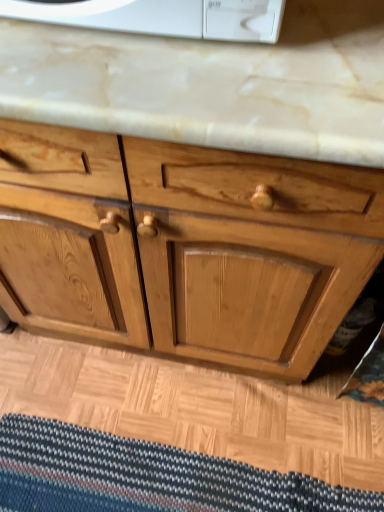
Question: Is striped fabric doormat at lower center spatially inside light brown wood chest of drawers at center, or outside of it?

Choices:
 (A) outside
 (B) inside

Answer: (A)

Question: From a real-world perspective, is striped fabric doormat at lower center physically located above or below light brown wood chest of drawers at center?

Choices:
 (A) below
 (B) above

Answer: (A)

Question: Is point (11, 465) positioned closer to the camera than point (233, 177)?

Choices:
 (A) closer
 (B) farther

Answer: (B)

Question: Considering the positions of light brown wood chest of drawers at center and striped fabric doormat at lower center in the image, is light brown wood chest of drawers at center bigger or smaller than striped fabric doormat at lower center?

Choices:
 (A) big
 (B) small

Answer: (A)

Question: From their relative heights in the image, would you say light brown wood chest of drawers at center is taller or shorter than striped fabric doormat at lower center?

Choices:
 (A) tall
 (B) short

Answer: (A)

Question: Is light brown wood chest of drawers at center spatially inside striped fabric doormat at lower center, or outside of it?

Choices:
 (A) inside
 (B) outside

Answer: (B)

Question: Looking at their shapes, would you say light brown wood chest of drawers at center is wider or thinner than striped fabric doormat at lower center?

Choices:
 (A) thin
 (B) wide

Answer: (B)